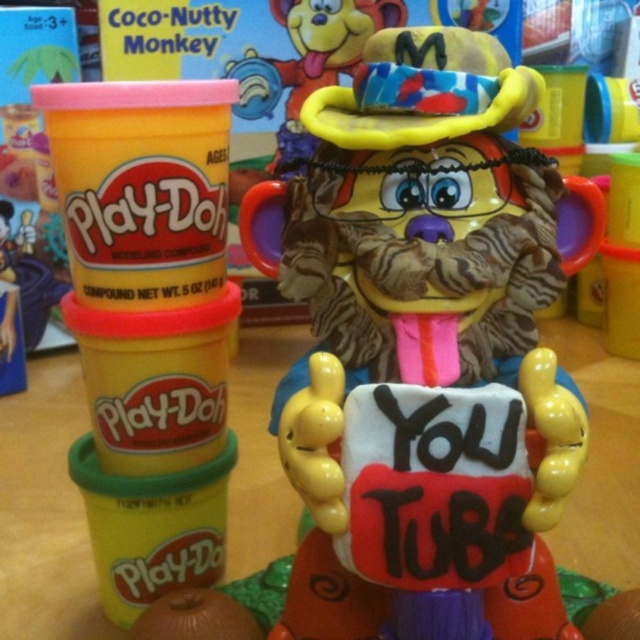
Question: Which point appears farthest from the camera in this image?

Choices:
 (A) (390, 337)
 (B) (289, 148)

Answer: (B)

Question: Where is matte plastic monkey at center located in relation to rubberized yellow ring at upper center in the image?

Choices:
 (A) left
 (B) right

Answer: (B)

Question: Is matte plastic monkey at center below rubberized yellow ring at upper center?

Choices:
 (A) no
 (B) yes

Answer: (B)

Question: Does matte plastic monkey at center have a greater width compared to rubberized yellow ring at upper center?

Choices:
 (A) no
 (B) yes

Answer: (B)

Question: Which of the following is the closest to the observer?

Choices:
 (A) rubberized yellow ring at upper center
 (B) matte plastic monkey at center

Answer: (B)